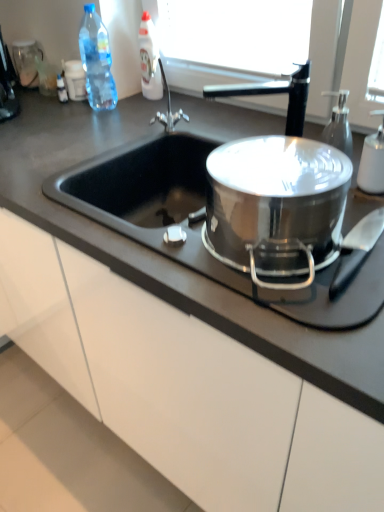
Locate an element on the screen. The width and height of the screenshot is (384, 512). free space on the front side of transparent plastic bottle at upper left, the second bottle viewed from the front is located at coordinates (91, 124).